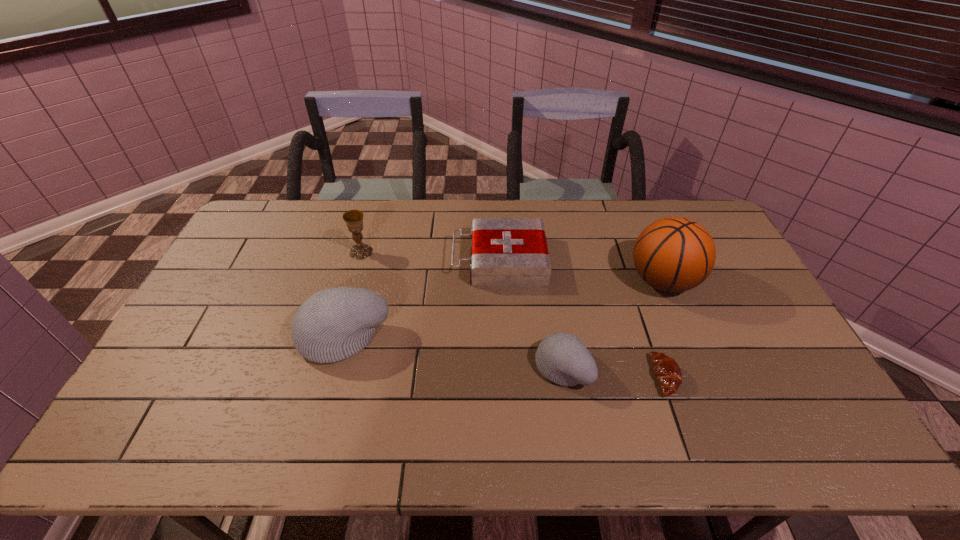
This screenshot has height=540, width=960. Find the location of `vacant position at the near edge of the desktop`. vacant position at the near edge of the desktop is located at coordinates (451, 398).

The width and height of the screenshot is (960, 540). I want to click on free point at the left edge, so click(x=249, y=267).

In the image, there is a desktop. At what (x,y) coordinates should I click in order to perform the action: click on vacant space at the right edge. Please return your answer as a coordinate pair (x, y). The image size is (960, 540). Looking at the image, I should click on (776, 323).

Identify the location of vacant region at the far right corner of the desktop. This screenshot has height=540, width=960. (694, 203).

The width and height of the screenshot is (960, 540). In the image, there is a desktop. Identify the location of free space at the near right corner. (786, 402).

This screenshot has width=960, height=540. I want to click on free space between the tallest object and the left beanie, so click(503, 308).

You are a GUI agent. You are given a task and a screenshot of the screen. Output one action in this format:
    pyautogui.click(x=<x>, y=<y>)
    Task: Click on the vacant point located between the right beanie and the taller beanie
    This screenshot has height=540, width=960.
    Given the screenshot: What is the action you would take?
    pyautogui.click(x=453, y=351)

Where is `vacant region between the shorter beanie and the taller beanie`? This screenshot has width=960, height=540. vacant region between the shorter beanie and the taller beanie is located at coordinates (453, 351).

What are the coordinates of `empty space between the fifth tallest object and the tallest object` in the screenshot? It's located at pos(582,271).

The height and width of the screenshot is (540, 960). I want to click on free space between the fifth tallest object and the fourth tallest object, so click(531, 314).